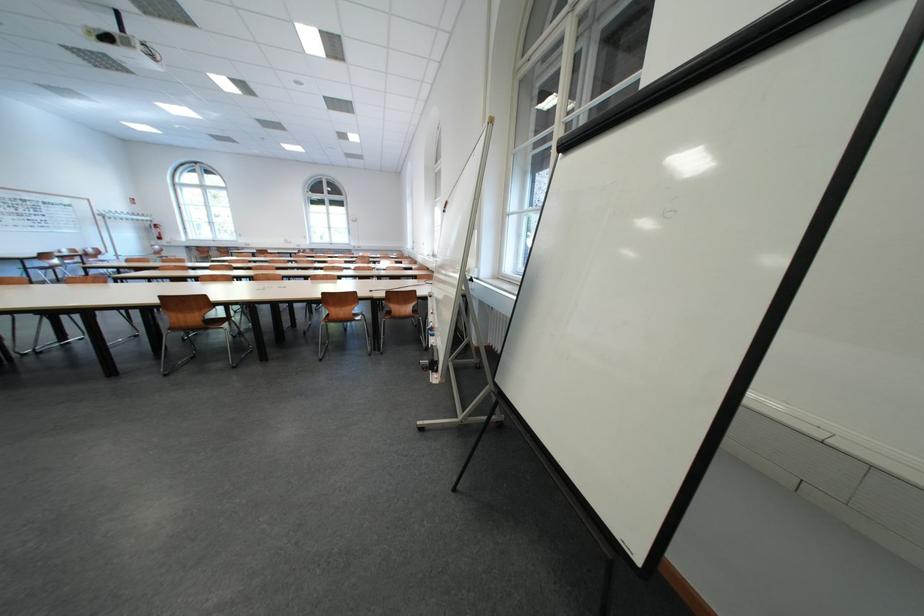
Where would you sit the brown chair sitting surface? Please return your answer as a coordinate pair (x, y).

(214, 322)